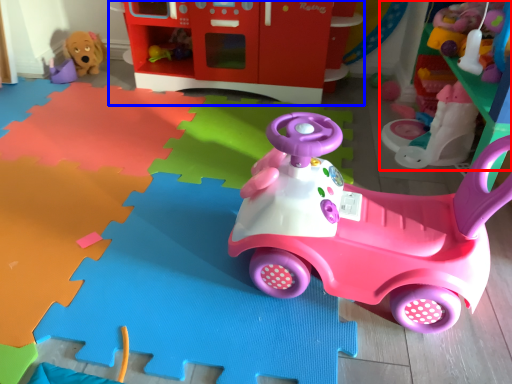
Question: Which object is closer to the camera taking this photo, toy (highlighted by a red box) or toy (highlighted by a blue box)?

Choices:
 (A) toy
 (B) toy

Answer: (A)